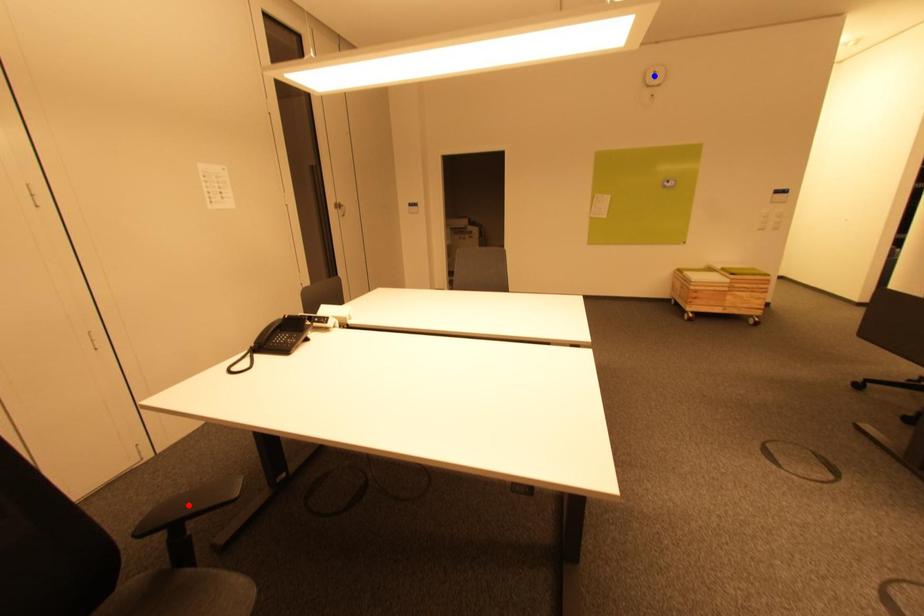
Question: Which of the two points in the image is closer to the camera?

Choices:
 (A) Blue point is closer.
 (B) Red point is closer.

Answer: (B)